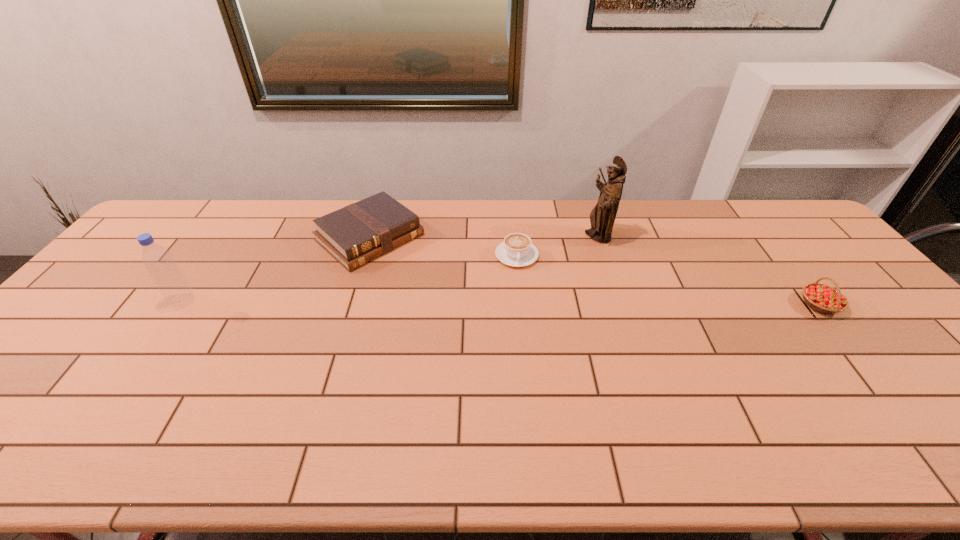
You are a GUI agent. You are given a task and a screenshot of the screen. Output one action in this format:
    pyautogui.click(x=<x>, y=<y>)
    Task: Click on the vacant space that satisfies the following two spatial constraints: 1. on the front side of the strawberry; 2. on the right side of the tallest object
    The height and width of the screenshot is (540, 960).
    Given the screenshot: What is the action you would take?
    pyautogui.click(x=621, y=305)

Where is `free space that satisfies the following two spatial constraints: 1. on the front side of the strawberry; 2. on the right side of the bottle`? This screenshot has width=960, height=540. free space that satisfies the following two spatial constraints: 1. on the front side of the strawberry; 2. on the right side of the bottle is located at coordinates (180, 305).